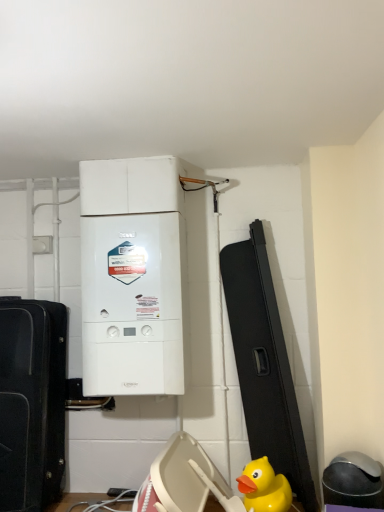
Question: From the image's perspective, is black matte suitcase at left above yellow rubber duck at lower right?

Choices:
 (A) yes
 (B) no

Answer: (A)

Question: Does black matte suitcase at left have a lesser height compared to yellow rubber duck at lower right?

Choices:
 (A) no
 (B) yes

Answer: (A)

Question: Considering the relative positions of black matte suitcase at left and yellow rubber duck at lower right in the image provided, is black matte suitcase at left behind yellow rubber duck at lower right?

Choices:
 (A) no
 (B) yes

Answer: (B)

Question: From a real-world perspective, is black matte suitcase at left located higher than yellow rubber duck at lower right?

Choices:
 (A) yes
 (B) no

Answer: (A)

Question: Is black matte suitcase at left next to yellow rubber duck at lower right and touching it?

Choices:
 (A) no
 (B) yes

Answer: (A)

Question: Is yellow rubber duck at lower right located within black matte suitcase at left?

Choices:
 (A) no
 (B) yes

Answer: (A)

Question: Is yellow rubber duck at lower right further to the viewer compared to white matte boiler at center?

Choices:
 (A) no
 (B) yes

Answer: (A)

Question: Is yellow rubber duck at lower right at the left side of white matte boiler at center?

Choices:
 (A) no
 (B) yes

Answer: (A)

Question: Does yellow rubber duck at lower right come in front of white matte boiler at center?

Choices:
 (A) no
 (B) yes

Answer: (B)

Question: From the image's perspective, is yellow rubber duck at lower right above white matte boiler at center?

Choices:
 (A) no
 (B) yes

Answer: (A)

Question: Could you tell me if yellow rubber duck at lower right is turned towards white matte boiler at center?

Choices:
 (A) no
 (B) yes

Answer: (A)

Question: Is yellow rubber duck at lower right smaller than white matte boiler at center?

Choices:
 (A) no
 (B) yes

Answer: (B)

Question: Is white matte boiler at center far away from yellow rubber duck at lower right?

Choices:
 (A) yes
 (B) no

Answer: (B)